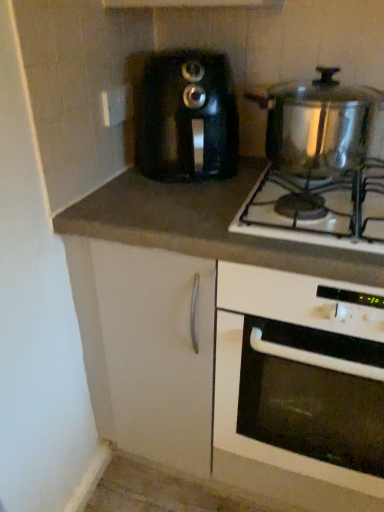
This screenshot has width=384, height=512. What are the coordinates of `free space in front of black plastic toaster at center` in the screenshot? It's located at (155, 207).